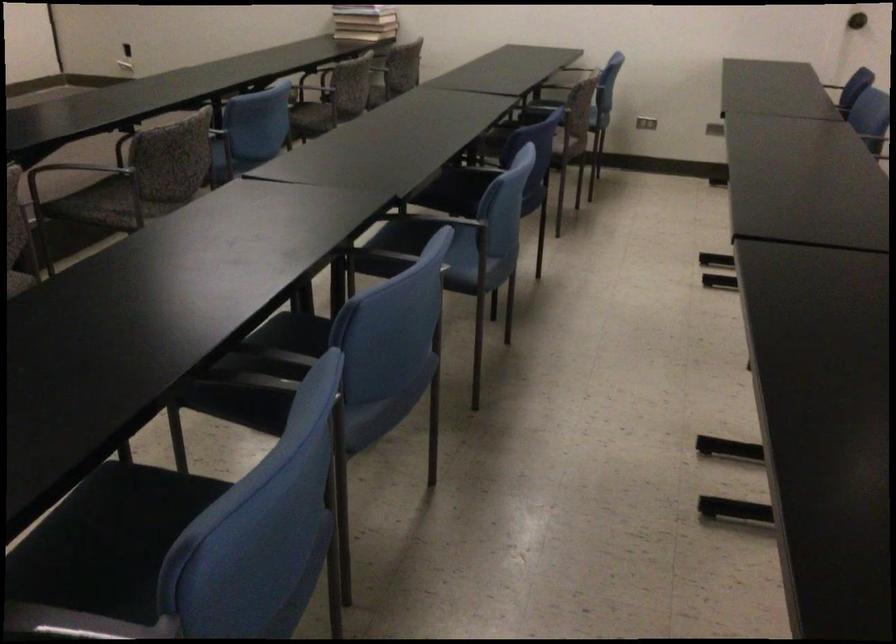
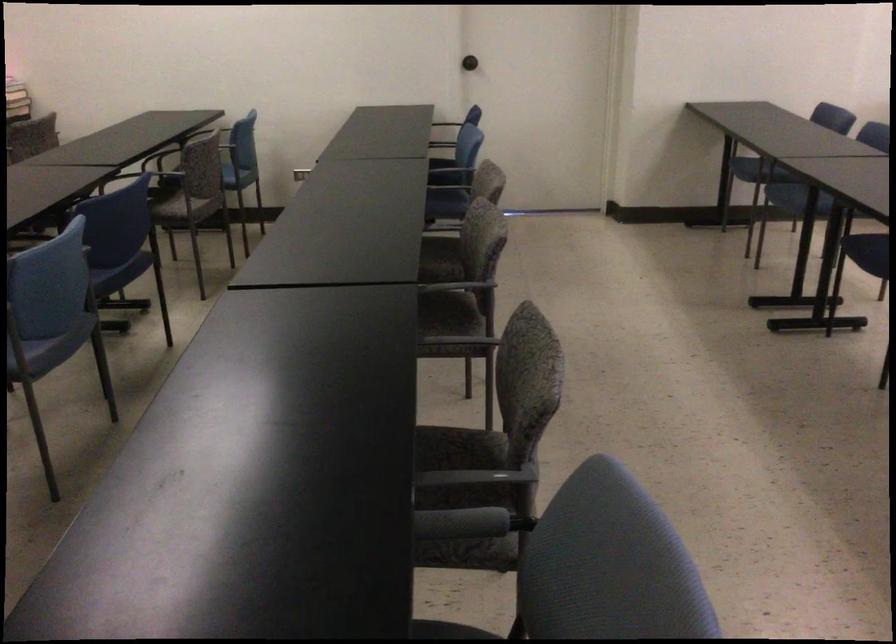
Question: The images are taken continuously from a first-person perspective. In which direction are you moving?

Choices:
 (A) Left
 (B) Right
 (C) Forward
 (D) Backward

Answer: (B)